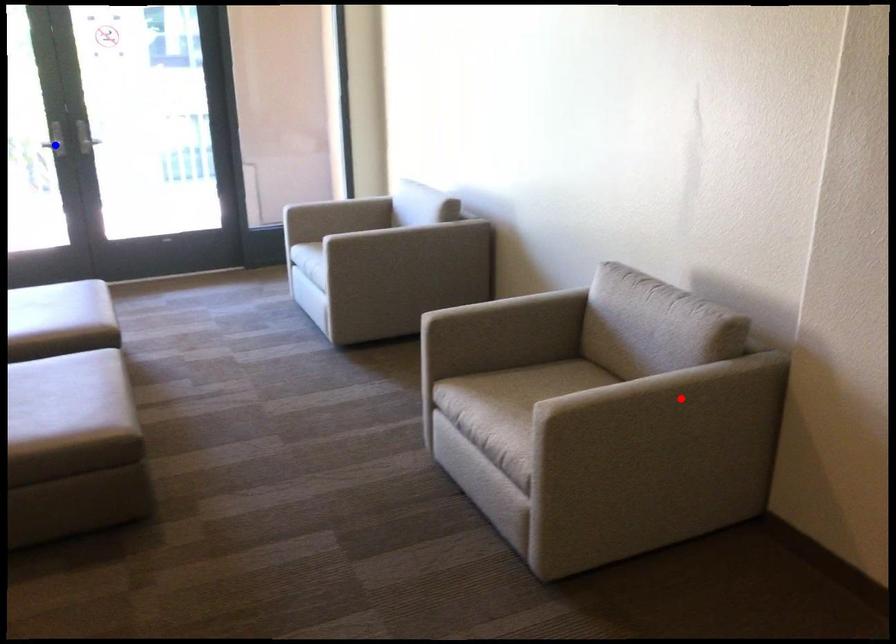
Question: Which of the two points in the image is closer to the camera?

Choices:
 (A) Blue point is closer.
 (B) Red point is closer.

Answer: (B)